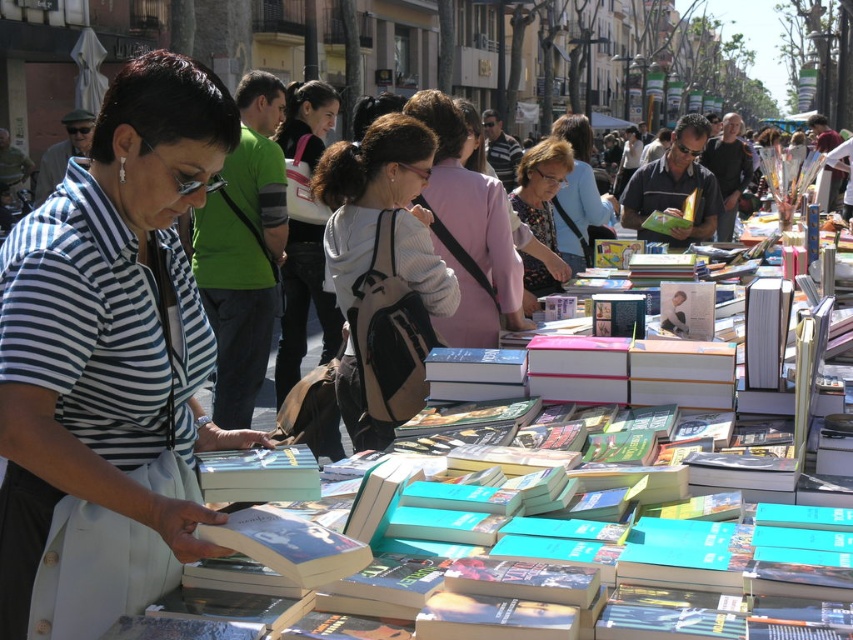
Is light gray backpack at center in front of pink fabric at center?

Yes, light gray backpack at center is in front of pink fabric at center.

What do you see at coordinates (381, 273) in the screenshot?
I see `light gray backpack at center` at bounding box center [381, 273].

Image resolution: width=853 pixels, height=640 pixels. In order to click on light gray backpack at center in this screenshot , I will do `click(381, 273)`.

Is point (546, 170) positioned in front of point (595, 221)?

Yes, point (546, 170) is in front of point (595, 221).

Does point (549, 212) come farther from viewer compared to point (553, 208)?

No, it is in front of (553, 208).

The width and height of the screenshot is (853, 640). What do you see at coordinates (541, 186) in the screenshot? I see `patterned fabric blouse at center` at bounding box center [541, 186].

This screenshot has height=640, width=853. In order to click on patterned fabric blouse at center in this screenshot , I will do `click(541, 186)`.

Find the location of a particular element. Image resolution: width=853 pixels, height=640 pixels. light pink fabric jacket at center is located at coordinates (468, 230).

Between light pink fabric jacket at center and green matte book at center, which one has more height?

light pink fabric jacket at center is taller.

Identify the location of light pink fabric jacket at center. This screenshot has height=640, width=853. (468, 230).